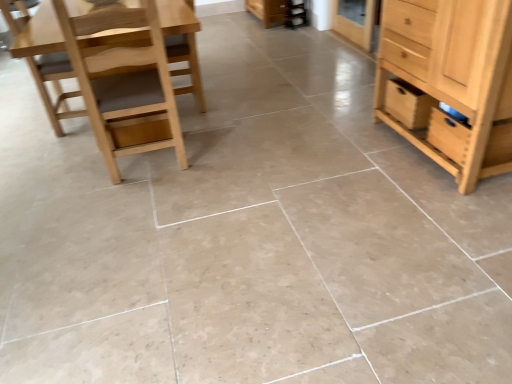
Question: From a real-world perspective, is wooden drawer at right positioned above or below light brown wood chair at left, marked as the second chair in a right-to-left arrangement?

Choices:
 (A) above
 (B) below

Answer: (B)

Question: In the image, is wooden drawer at right on the left side or the right side of light brown wood chair at left, acting as the 1th chair starting from the left?

Choices:
 (A) right
 (B) left

Answer: (A)

Question: Estimate the real-world distances between objects in this image. Which object is closer to the light brown wood chair at left, marked as the second chair in a right-to-left arrangement?

Choices:
 (A) light brown wood chair at left, the first chair viewed from the right
 (B) natural wood cabinet at right
 (C) wooden drawer at right

Answer: (A)

Question: Estimate the real-world distances between objects in this image. Which object is closer to the wooden drawer at right?

Choices:
 (A) natural wood cabinet at right
 (B) light brown wood chair at left, acting as the 1th chair starting from the left
 (C) light brown wood chair at left, the first chair viewed from the right

Answer: (A)